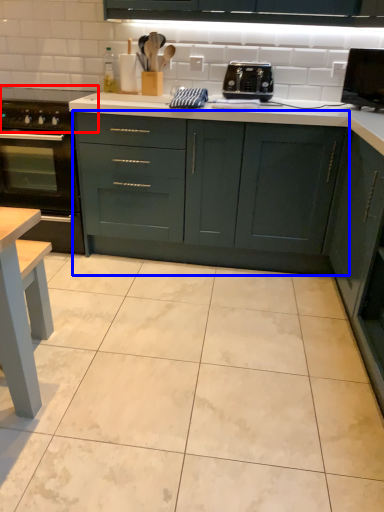
Question: Which object is further to the camera taking this photo, gas stove (highlighted by a red box) or cabinetry (highlighted by a blue box)?

Choices:
 (A) gas stove
 (B) cabinetry

Answer: (A)